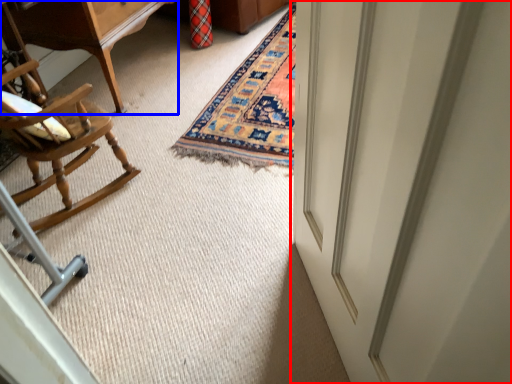
Question: Which object is further to the camera taking this photo, door (highlighted by a red box) or table (highlighted by a blue box)?

Choices:
 (A) door
 (B) table

Answer: (B)